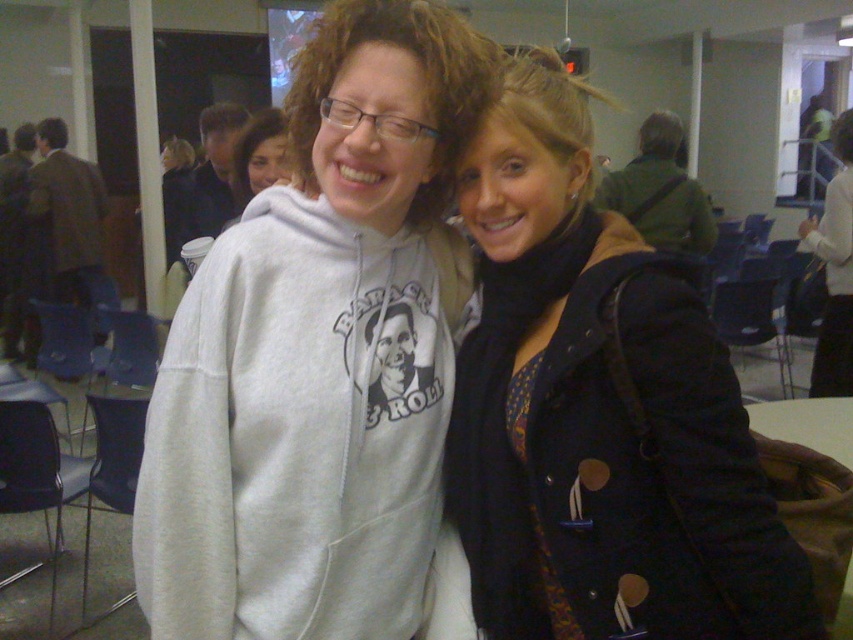
You are a photographer trying to capture both the gray sweatshirt at center and the dark blue textured coat at center in a single frame. Since you want both to be clearly visible, which clothing item should you focus on first to ensure proper exposure, considering their sizes?

The gray sweatshirt at center is larger in size than the dark blue textured coat at center, so you should focus on the gray sweatshirt at center first to ensure proper exposure, as its larger size will require more attention to capture details clearly.

You are organizing a photo shoot and need to position a light source to the right of the gray sweatshirt at center. Given the room layout described, is there enough space to place the light there without blocking the view of the background door?

The gray sweatshirt at center is located at point [318,355]. Since the room has chairs and tables visible and a door in the background, there should be sufficient space to place the light to the right of the gray sweatshirt at center without obstructing the door view, assuming standard spacing between furniture.

Based on the photo, you are organizing a photo shoot and need to ensure that the two central outfits fit through a narrow doorway. Given that the doorway is 1.2 meters wide, can both the gray sweatshirt at center and the dark blue textured coat at center be worn by models passing through side by side?

The gray sweatshirt at center is wider than the dark blue textured coat at center. However, without knowing the exact widths of both items, it is impossible to determine if their combined width exceeds the 1.2 meter doorway. Additional measurements are needed.